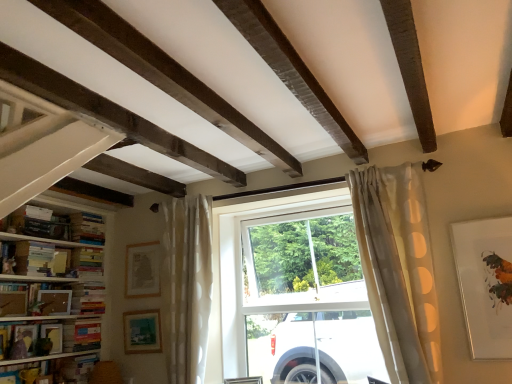
Image resolution: width=512 pixels, height=384 pixels. What do you see at coordinates (81, 335) in the screenshot?
I see `hardcover book at left, which is counted as the 2th book, starting from the bottom` at bounding box center [81, 335].

In order to face hardcover books at left, placed as the 4th book when sorted from top to bottom, should I rotate leftwards or rightwards?

To align with it, rotate left about 21.934°.

This screenshot has width=512, height=384. Identify the location of matte wooden picture frame at lower left, the 2th picture frame when ordered from right to left. (142, 331).

Describe the element at coordinates (55, 302) in the screenshot. I see `matte wooden picture frame at lower left, which is counted as the second picture frame, starting from the left` at that location.

Locate an element on the screen. The height and width of the screenshot is (384, 512). hardcover book at left, which is counted as the 2th book, starting from the bottom is located at coordinates (81, 335).

Based on the photo, can you confirm if matte wooden picture frame at lower left, the 2th picture frame when ordered from right to left, is thinner than hardcover book at left, which is counted as the 2th book, starting from the bottom?

Yes.

Considering their positions, is matte wooden picture frame at lower left, the 4th picture frame viewed from the left, located in front of or behind hardcover book at left, which is counted as the 2th book, starting from the bottom?

Visually, matte wooden picture frame at lower left, the 4th picture frame viewed from the left, is located behind hardcover book at left, which is counted as the 2th book, starting from the bottom.

Is matte wooden picture frame at lower left, the 4th picture frame from the front, turned away from hardcover book at left, which is counted as the 2th book, starting from the bottom?

No, hardcover book at left, which is counted as the 2th book, starting from the bottom, is not at the back of matte wooden picture frame at lower left, the 4th picture frame from the front.

Who is taller, matte wooden picture frame at lower left, the 2th picture frame when ordered from back to front, or hardcover book at left, which appears as the 7th book when viewed from the top?

matte wooden picture frame at lower left, the 2th picture frame when ordered from back to front, is taller.

From a real-world perspective, is matte gold picture frame at lower left, placed as the third picture frame when sorted from front to back, physically below matte wooden picture frame at lower left, which is counted as the second picture frame, starting from the left?

Yes, from a real-world perspective, matte gold picture frame at lower left, placed as the third picture frame when sorted from front to back, is below matte wooden picture frame at lower left, which is counted as the second picture frame, starting from the left.

Measure the distance from matte gold picture frame at lower left, positioned as the 3th picture frame in back-to-front order, to matte wooden picture frame at lower left, which is counted as the second picture frame, starting from the left.

matte gold picture frame at lower left, positioned as the 3th picture frame in back-to-front order, and matte wooden picture frame at lower left, which is counted as the second picture frame, starting from the left, are 5.98 inches apart from each other.

Is matte gold picture frame at lower left, placed as the third picture frame when sorted from front to back, far from matte wooden picture frame at lower left, the fourth picture frame when ordered from back to front?

That's not correct — matte gold picture frame at lower left, placed as the third picture frame when sorted from front to back, is a little close to matte wooden picture frame at lower left, the fourth picture frame when ordered from back to front.

Can you confirm if matte gold picture frame at lower left, the fifth picture frame from the right, is taller than matte wooden picture frame at lower left, positioned as the fourth picture frame in right-to-left order?

Correct, matte gold picture frame at lower left, the fifth picture frame from the right, is much taller as matte wooden picture frame at lower left, positioned as the fourth picture frame in right-to-left order.

Is matte gold picture frame at lower left, the fifth picture frame from the right, facing towards hardcover books at left, which is the 2th book from top to bottom?

No, matte gold picture frame at lower left, the fifth picture frame from the right, does not turn towards hardcover books at left, which is the 2th book from top to bottom.

In the image, is matte gold picture frame at lower left, the fifth picture frame from the right, on the left side or the right side of hardcover books at left, the 7th book positioned from the bottom?

Based on their positions, matte gold picture frame at lower left, the fifth picture frame from the right, is located to the left of hardcover books at left, the 7th book positioned from the bottom.

Is point (53, 348) closer or farther from the camera than point (94, 221)?

Point (53, 348) is positioned closer to the camera compared to point (94, 221).

Could you measure the distance between matte gold picture frame at lower left, positioned as the 3th picture frame in back-to-front order, and hardcover books at left, the 7th book positioned from the bottom?

matte gold picture frame at lower left, positioned as the 3th picture frame in back-to-front order, and hardcover books at left, the 7th book positioned from the bottom, are 27.41 inches apart from each other.

Is white polka dot fabric at right, which appears as the 1th curtain when viewed from the right, further to the viewer compared to matte brown cabinet at lower left?

No.

From the picture: Can you tell me how much white polka dot fabric at right, the second curtain positioned from the left, and matte brown cabinet at lower left differ in facing direction?

88.2 degrees.

Is white polka dot fabric at right, arranged as the 1th curtain when viewed from the front, beside matte brown cabinet at lower left?

No, white polka dot fabric at right, arranged as the 1th curtain when viewed from the front, is not making contact with matte brown cabinet at lower left.

Locate an element on the screen. This screenshot has height=384, width=512. the 2nd curtain above when counting from the matte brown cabinet at lower left (from the image's perspective) is located at coordinates (398, 269).

Is matte black bookshelf at lower left, which is the 4th book in bottom-to-top order, situated inside matte wooden book at lower left, which is the 6th book from top to bottom, or outside?

matte black bookshelf at lower left, which is the 4th book in bottom-to-top order, is enclosed within matte wooden book at lower left, which is the 6th book from top to bottom.

From the matte black bookshelf at lower left, which is the 4th book in bottom-to-top order, count the 2nd book to the left and point to it. Please provide its 2D coordinates.

[(48, 337)]

Does matte black bookshelf at lower left, which is the 4th book in bottom-to-top order, turn towards matte wooden book at lower left, arranged as the third book when ordered from the bottom?

Yes, matte black bookshelf at lower left, which is the 4th book in bottom-to-top order, is facing matte wooden book at lower left, arranged as the third book when ordered from the bottom.

Which of these two, matte white picture frame at upper right, which ranks as the first picture frame in right-to-left order, or matte wooden book at lower left, arranged as the third book when ordered from the bottom, is wider?

Wider between the two is matte wooden book at lower left, arranged as the third book when ordered from the bottom.

Is matte wooden book at lower left, arranged as the third book when ordered from the bottom, located within matte white picture frame at upper right, which ranks as the first picture frame in right-to-left order?

Actually, matte wooden book at lower left, arranged as the third book when ordered from the bottom, is outside matte white picture frame at upper right, which ranks as the first picture frame in right-to-left order.

Who is shorter, matte white picture frame at upper right, the 5th picture frame from the back, or matte wooden book at lower left, which is the 6th book from top to bottom?

matte wooden book at lower left, which is the 6th book from top to bottom.

Are matte white picture frame at upper right, which ranks as the first picture frame in front-to-back order, and matte wooden book at lower left, arranged as the third book when ordered from the bottom, far apart?

Yes, matte white picture frame at upper right, which ranks as the first picture frame in front-to-back order, is far from matte wooden book at lower left, arranged as the third book when ordered from the bottom.

Between matte black bookshelf at lower left, the fifth book positioned from the top, and matte brown cabinet at lower left, which one has less height?

matte brown cabinet at lower left.

Is matte black bookshelf at lower left, the fifth book positioned from the top, facing towards matte brown cabinet at lower left?

No, matte black bookshelf at lower left, the fifth book positioned from the top, is not oriented towards matte brown cabinet at lower left.

Would you say matte brown cabinet at lower left is part of matte black bookshelf at lower left, which is the 4th book in bottom-to-top order,'s contents?

Definitely not — matte brown cabinet at lower left is not inside matte black bookshelf at lower left, which is the 4th book in bottom-to-top order.

Can you confirm if matte black bookshelf at lower left, the fifth book positioned from the top, is bigger than matte brown cabinet at lower left?

Incorrect, matte black bookshelf at lower left, the fifth book positioned from the top, is not larger than matte brown cabinet at lower left.

From a real-world perspective, count 1st books upward from the matte wooden picture frame at lower left, the 2th picture frame when ordered from back to front, and point to it. Please provide its 2D coordinates.

[(81, 335)]

From a real-world perspective, count 3rd picture frames downward from the matte wooden picture frame at lower left, the fourth picture frame when ordered from back to front, and point to it. Please provide its 2D coordinates.

[(53, 336)]

Looking at the image, which one is located closer to matte wooden book at lower left, which is the 6th book from top to bottom, matte brown cabinet at lower left or hardcover books at left, placed as the 6th book when sorted from bottom to top?

matte brown cabinet at lower left is closer to matte wooden book at lower left, which is the 6th book from top to bottom.

Estimate the real-world distances between objects in this image. Which object is closer to hardcover books at left, placed as the 6th book when sorted from bottom to top, hardcover books at left, placed as the 4th book when sorted from top to bottom, or hardcover book at lower left, acting as the first book starting from the bottom?

hardcover books at left, placed as the 4th book when sorted from top to bottom.

Based on their spatial positions, is hardcover book at lower left, acting as the first book starting from the bottom, or hardcover books at left, which is counted as the 5th book, starting from the bottom, closer to matte black bookshelf at lower left, which is the 4th book in bottom-to-top order?

hardcover book at lower left, acting as the first book starting from the bottom, lies closer to matte black bookshelf at lower left, which is the 4th book in bottom-to-top order, than the other object.

From the image, which object appears to be farther from hardcover book at lower left, acting as the first book starting from the bottom, matte wooden book at lower left, which is the 6th book from top to bottom, or hardcover books at left, which is the 3th book in top-to-bottom order?

Based on the image, hardcover books at left, which is the 3th book in top-to-bottom order, appears to be further to hardcover book at lower left, acting as the first book starting from the bottom.

Estimate the real-world distances between objects in this image. Which object is closer to hardcover books at left, which is counted as the 5th book, starting from the bottom, white sheer curtain at center, the 2th curtain when ordered from front to back, or matte brown cabinet at lower left?

Answer: matte brown cabinet at lower left lies closer to hardcover books at left, which is counted as the 5th book, starting from the bottom, than the other object.

From the image, which object appears to be nearer to matte black bookshelf at lower left, which is the 4th book in bottom-to-top order, matte white picture frame at upper right, arranged as the fifth picture frame when viewed from the left, or hardcover books at left, which is counted as the 5th book, starting from the bottom?

Based on the image, hardcover books at left, which is counted as the 5th book, starting from the bottom, appears to be nearer to matte black bookshelf at lower left, which is the 4th book in bottom-to-top order.

Looking at the image, which one is located further to matte brown cabinet at lower left, matte black bookshelf at lower left, which is the 4th book in bottom-to-top order, or matte wooden picture frame at lower left, the 2th picture frame when ordered from back to front?

The object further to matte brown cabinet at lower left is matte wooden picture frame at lower left, the 2th picture frame when ordered from back to front.

When comparing their distances from matte black bookshelf at lower left, which is the 4th book in bottom-to-top order, does matte brown cabinet at lower left or hardcover books at left, the 7th book positioned from the bottom, seem further?

hardcover books at left, the 7th book positioned from the bottom, is positioned further to the anchor matte black bookshelf at lower left, which is the 4th book in bottom-to-top order.

Find the location of `shelf between hardcover books at left, which is the 2th book from top to bottom, and matte gold picture frame at lower left, the fifth picture frame from the right, in the up-down direction`. shelf between hardcover books at left, which is the 2th book from top to bottom, and matte gold picture frame at lower left, the fifth picture frame from the right, in the up-down direction is located at coordinates (50, 299).

You are a GUI agent. You are given a task and a screenshot of the screen. Output one action in this format:
    pyautogui.click(x=<x>, y=<y>)
    Task: Click on the curtain between hardcover books at left, which is the 2th book from top to bottom, and white polka dot fabric at right, the second curtain positioned from the left, in the horizontal direction
    
    Given the screenshot: What is the action you would take?
    pyautogui.click(x=186, y=286)

Find the location of a particular element. The image size is (512, 384). shelf located between hardcover books at left, marked as the first book in a top-to-bottom arrangement, and matte white picture frame at upper right, the 5th picture frame from the back, in the left-right direction is located at coordinates (50, 299).

At what (x,y) coordinates should I click in order to perform the action: click on shelf between hardcover books at left, positioned as the eighth book in bottom-to-top order, and matte black bookshelf at lower left, which is the 4th book in bottom-to-top order, vertically. Please return your answer as a coordinate pair (x, y). The image size is (512, 384). Looking at the image, I should click on [50, 299].